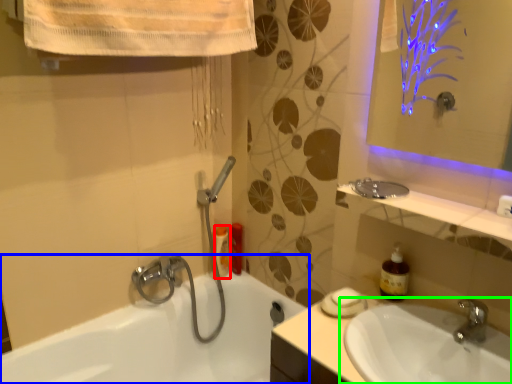
Question: Which object is positioned farthest from toiletry (highlighted by a red box)? Select from bathtub (highlighted by a blue box) and sink (highlighted by a green box).

Choices:
 (A) bathtub
 (B) sink

Answer: (B)